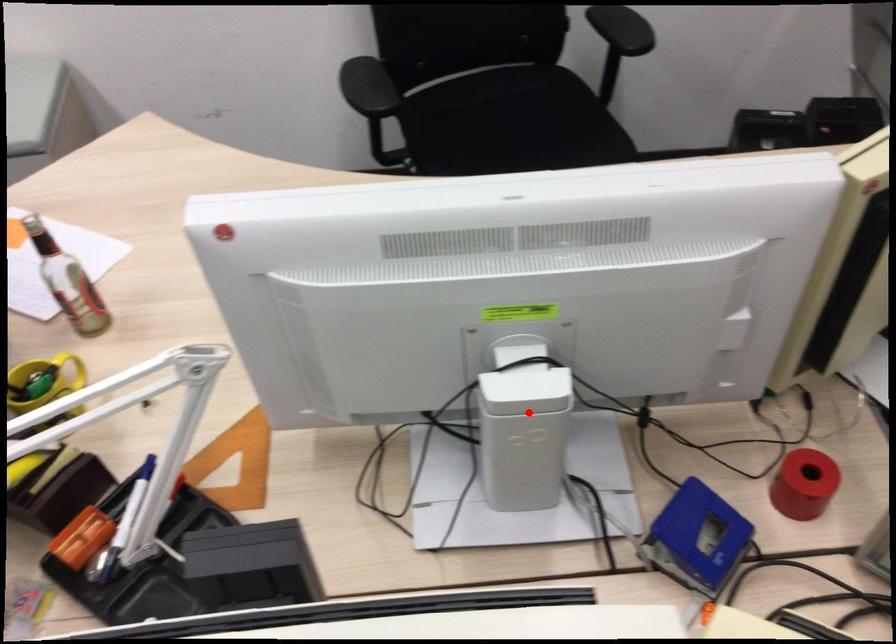
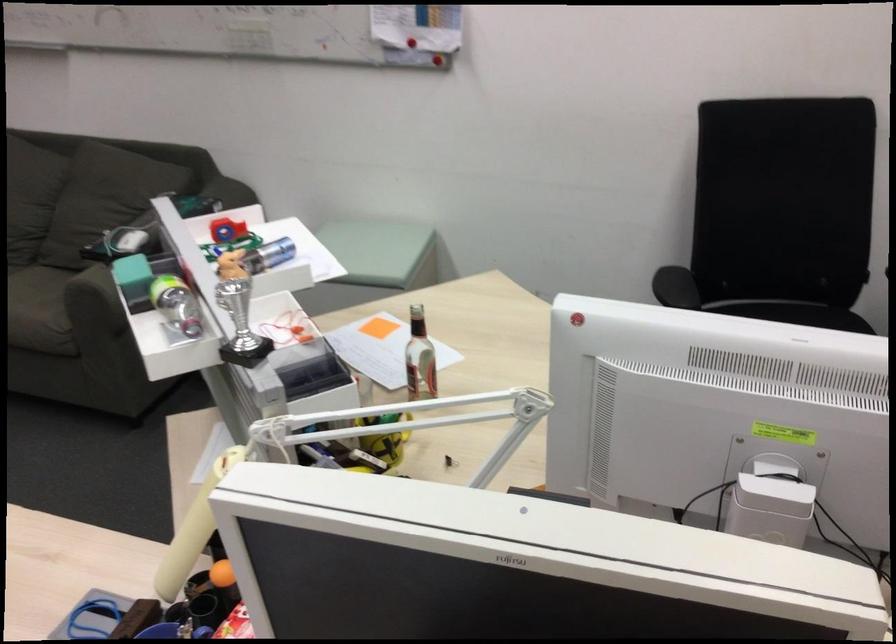
The point at the highlighted location is marked in the first image. Where is the corresponding point in the second image?

(770, 509)